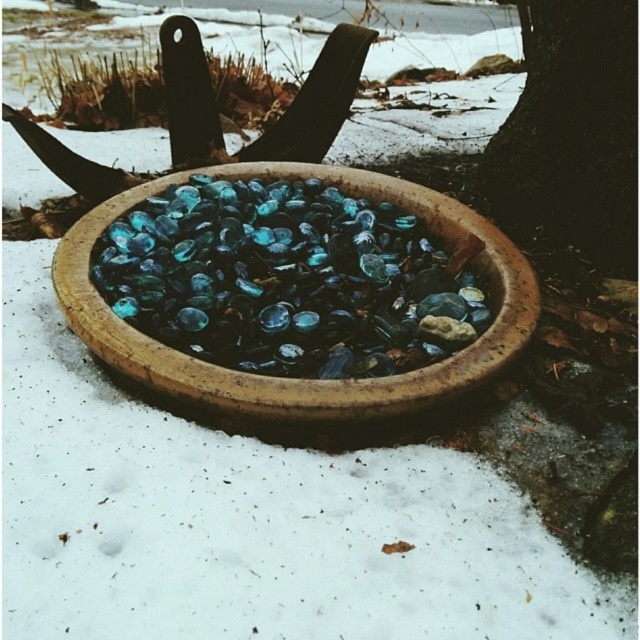
Can you confirm if translucent glass bowl at center is thinner than dark brown textured tree trunk at upper right?

No, translucent glass bowl at center is not thinner than dark brown textured tree trunk at upper right.

Between translucent glass bowl at center and dark brown textured tree trunk at upper right, which one has less height?

Standing shorter between the two is translucent glass bowl at center.

Who is more forward, (124, 330) or (612, 220)?

Positioned in front is point (124, 330).

The image size is (640, 640). I want to click on translucent glass bowl at center, so (301, 378).